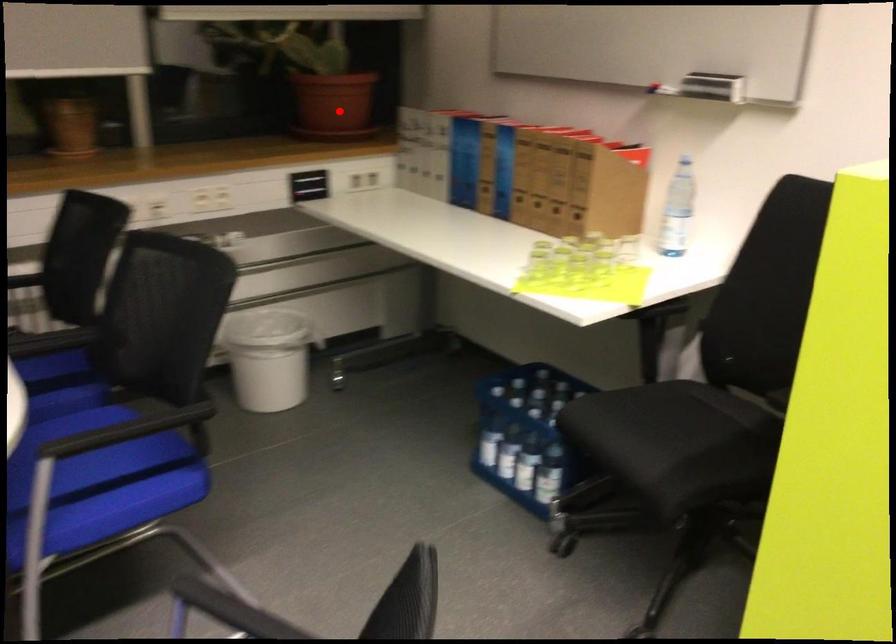
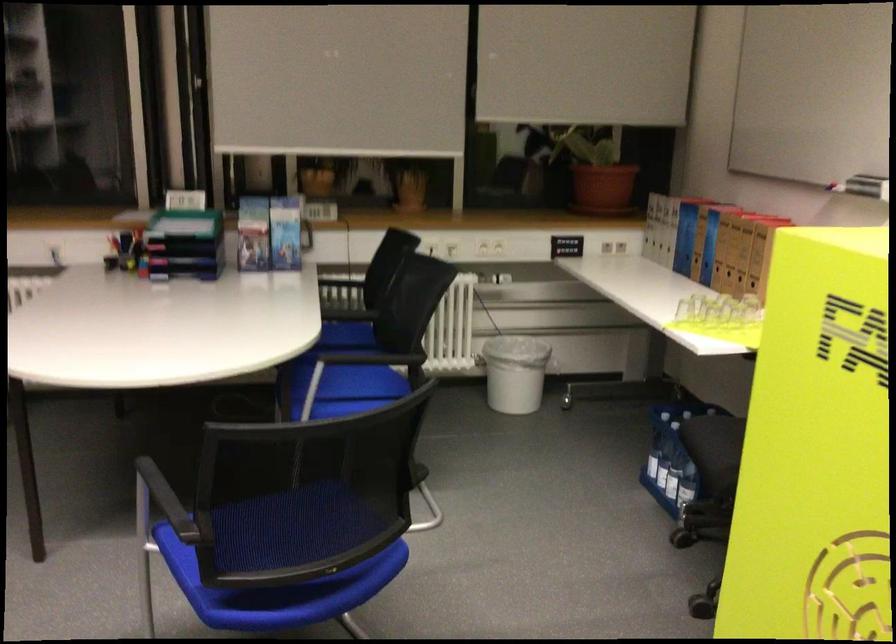
Question: I am providing you with two images of the same scene from different viewpoints. Image1 has a red point marked. In image2, the corresponding 3D location appears at what relative position? Reply with the corresponding letter.

Choices:
 (A) Closer
 (B) Farther

Answer: (B)